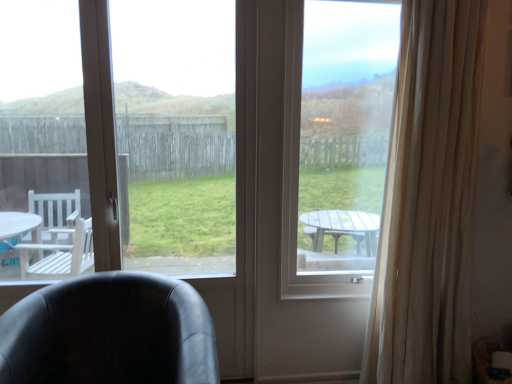
What is the approximate width of transparent glass window at center, the first window screen from the right?

transparent glass window at center, the first window screen from the right, is 4.97 inches wide.

What is the approximate width of beige sheer curtain at right?

beige sheer curtain at right is 11.47 inches wide.

What do you see at coordinates (177, 133) in the screenshot? I see `transparent glass window at center, which ranks as the 1th window screen in left-to-right order` at bounding box center [177, 133].

In order to face black leather chair at lower left, should I rotate leftwards or rightwards?

Turn left approximately 19.223 degrees to face it.

Where is `transparent glass window at center, the first window screen from the right`? This screenshot has height=384, width=512. transparent glass window at center, the first window screen from the right is located at coordinates (335, 144).

From the image's perspective, would you say black leather chair at lower left is positioned over beige sheer curtain at right?

No, from the image's perspective, black leather chair at lower left is not over beige sheer curtain at right.

Could you tell me if black leather chair at lower left is turned towards beige sheer curtain at right?

No, black leather chair at lower left is not aimed at beige sheer curtain at right.

Is the depth of black leather chair at lower left less than that of beige sheer curtain at right?

Yes, it is in front of beige sheer curtain at right.

What's the angular difference between transparent glass window at center, the 2th window screen in the left-to-right sequence, and transparent glass window at center, placed as the second window screen when sorted from right to left,'s facing directions?

The angle between the facing direction of transparent glass window at center, the 2th window screen in the left-to-right sequence, and the facing direction of transparent glass window at center, placed as the second window screen when sorted from right to left, is 0.00135 degrees.

Does transparent glass window at center, the 2th window screen in the left-to-right sequence, have a lesser width compared to transparent glass window at center, placed as the second window screen when sorted from right to left?

No.

Is transparent glass window at center, the 2th window screen in the left-to-right sequence, completely or partially outside of transparent glass window at center, which ranks as the 1th window screen in left-to-right order?

Absolutely, transparent glass window at center, the 2th window screen in the left-to-right sequence, is external to transparent glass window at center, which ranks as the 1th window screen in left-to-right order.

Locate an element on the screen. window screen on the right of transparent glass window at center, placed as the second window screen when sorted from right to left is located at coordinates (335, 144).

Does transparent glass window at center, placed as the second window screen when sorted from right to left, have a larger size compared to beige sheer curtain at right?

Actually, transparent glass window at center, placed as the second window screen when sorted from right to left, might be smaller than beige sheer curtain at right.

From a real-world perspective, is transparent glass window at center, which ranks as the 1th window screen in left-to-right order, physically located above or below beige sheer curtain at right?

Clearly, from a real-world perspective, transparent glass window at center, which ranks as the 1th window screen in left-to-right order, is below beige sheer curtain at right.

Is the depth of transparent glass window at center, placed as the second window screen when sorted from right to left, greater than that of beige sheer curtain at right?

Yes.

Consider the image. From a real-world perspective, is beige sheer curtain at right physically located above or below transparent glass window at center, the 2th window screen in the left-to-right sequence?

beige sheer curtain at right is below transparent glass window at center, the 2th window screen in the left-to-right sequence.

Identify the location of the 2nd window screen above the beige sheer curtain at right (from the image's perspective). (335, 144).

What's the angular difference between beige sheer curtain at right and transparent glass window at center, the first window screen from the right,'s facing directions?

0.000129 degrees.

Is beige sheer curtain at right facing away from transparent glass window at center, the 2th window screen in the left-to-right sequence?

No.

Is black leather chair at lower left far away from transparent glass window at center, placed as the second window screen when sorted from right to left?

No, black leather chair at lower left is not far away from transparent glass window at center, placed as the second window screen when sorted from right to left.

From the image's perspective, is black leather chair at lower left located above or below transparent glass window at center, which ranks as the 1th window screen in left-to-right order?

From the image's perspective, black leather chair at lower left appears below transparent glass window at center, which ranks as the 1th window screen in left-to-right order.

In terms of size, does black leather chair at lower left appear bigger or smaller than transparent glass window at center, placed as the second window screen when sorted from right to left?

In the image, black leather chair at lower left appears to be larger than transparent glass window at center, placed as the second window screen when sorted from right to left.

Based on the photo, does black leather chair at lower left lie in front of transparent glass window at center, which ranks as the 1th window screen in left-to-right order?

Yes, black leather chair at lower left is closer to the camera.

Considering the relative positions of transparent glass window at center, the 2th window screen in the left-to-right sequence, and beige sheer curtain at right in the image provided, is transparent glass window at center, the 2th window screen in the left-to-right sequence, to the right of beige sheer curtain at right from the viewer's perspective?

No, transparent glass window at center, the 2th window screen in the left-to-right sequence, is not to the right of beige sheer curtain at right.

Would you say transparent glass window at center, the 2th window screen in the left-to-right sequence, is inside or outside beige sheer curtain at right?

transparent glass window at center, the 2th window screen in the left-to-right sequence, lies outside beige sheer curtain at right.

Which of these two, transparent glass window at center, the 2th window screen in the left-to-right sequence, or beige sheer curtain at right, is smaller?

transparent glass window at center, the 2th window screen in the left-to-right sequence.

Is transparent glass window at center, the first window screen from the right, facing towards beige sheer curtain at right?

No, transparent glass window at center, the first window screen from the right, is not aimed at beige sheer curtain at right.

In the image, is transparent glass window at center, placed as the second window screen when sorted from right to left, on the left side or the right side of black leather chair at lower left?

From the image, it's evident that transparent glass window at center, placed as the second window screen when sorted from right to left, is to the right of black leather chair at lower left.

Is black leather chair at lower left at the back of transparent glass window at center, which ranks as the 1th window screen in left-to-right order?

Result: Yes, transparent glass window at center, which ranks as the 1th window screen in left-to-right order, is facing away from black leather chair at lower left.

Considering the relative sizes of transparent glass window at center, which ranks as the 1th window screen in left-to-right order, and black leather chair at lower left in the image provided, is transparent glass window at center, which ranks as the 1th window screen in left-to-right order, wider than black leather chair at lower left?

No, transparent glass window at center, which ranks as the 1th window screen in left-to-right order, is not wider than black leather chair at lower left.

Find the location of a particular element. curtain located above the black leather chair at lower left (from a real-world perspective) is located at coordinates (428, 200).

Locate an element on the screen. This screenshot has height=384, width=512. window screen below the transparent glass window at center, the 2th window screen in the left-to-right sequence (from the image's perspective) is located at coordinates tap(177, 133).

Based on the photo, based on their spatial positions, is beige sheer curtain at right or transparent glass window at center, the 2th window screen in the left-to-right sequence, closer to black leather chair at lower left?

transparent glass window at center, the 2th window screen in the left-to-right sequence.

Estimate the real-world distances between objects in this image. Which object is closer to beige sheer curtain at right, transparent glass window at center, the first window screen from the right, or transparent glass window at center, placed as the second window screen when sorted from right to left?

The object closer to beige sheer curtain at right is transparent glass window at center, the first window screen from the right.

Consider the image. Based on their spatial positions, is transparent glass window at center, which ranks as the 1th window screen in left-to-right order, or beige sheer curtain at right further from transparent glass window at center, the 2th window screen in the left-to-right sequence?

Based on the image, transparent glass window at center, which ranks as the 1th window screen in left-to-right order, appears to be further to transparent glass window at center, the 2th window screen in the left-to-right sequence.

Based on their spatial positions, is beige sheer curtain at right or transparent glass window at center, placed as the second window screen when sorted from right to left, further from black leather chair at lower left?

beige sheer curtain at right is further to black leather chair at lower left.

From the picture: From the image, which object appears to be farther from beige sheer curtain at right, black leather chair at lower left or transparent glass window at center, the first window screen from the right?

Based on the image, black leather chair at lower left appears to be further to beige sheer curtain at right.

Considering their positions, is beige sheer curtain at right positioned further to transparent glass window at center, which ranks as the 1th window screen in left-to-right order, than transparent glass window at center, the 2th window screen in the left-to-right sequence?

The object further to transparent glass window at center, which ranks as the 1th window screen in left-to-right order, is beige sheer curtain at right.

Which object lies further to the anchor point transparent glass window at center, the 2th window screen in the left-to-right sequence, transparent glass window at center, which ranks as the 1th window screen in left-to-right order, or black leather chair at lower left?

The object further to transparent glass window at center, the 2th window screen in the left-to-right sequence, is black leather chair at lower left.

Based on their spatial positions, is transparent glass window at center, which ranks as the 1th window screen in left-to-right order, or black leather chair at lower left further from beige sheer curtain at right?

black leather chair at lower left.

Locate an element on the screen. window screen between transparent glass window at center, which ranks as the 1th window screen in left-to-right order, and beige sheer curtain at right from left to right is located at coordinates (335, 144).

The height and width of the screenshot is (384, 512). What are the coordinates of `window screen situated between black leather chair at lower left and transparent glass window at center, the 2th window screen in the left-to-right sequence, from left to right` in the screenshot? It's located at (177, 133).